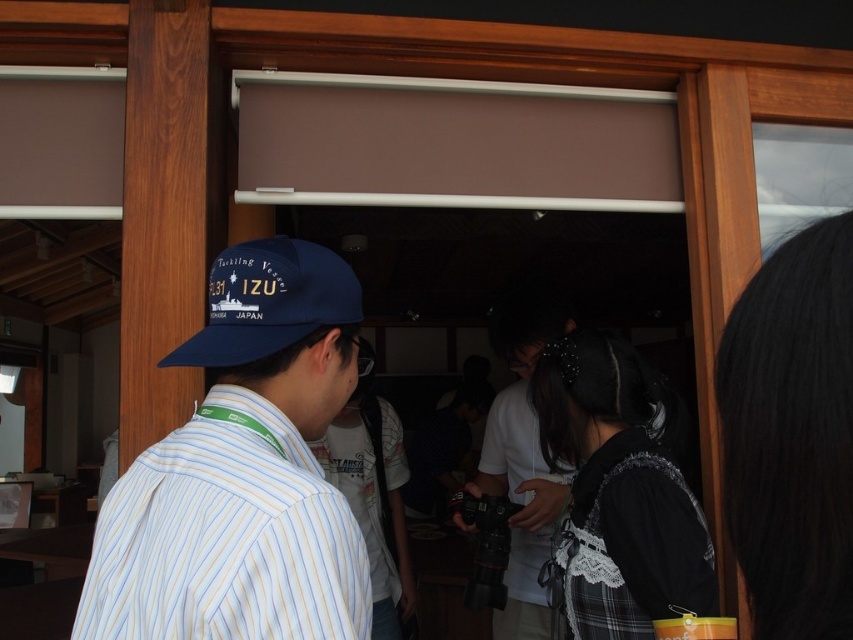
Question: Is white matte shirt at center positioned in front of matte blue baseball cap at upper left?

Choices:
 (A) no
 (B) yes

Answer: (A)

Question: Among these objects, which one is farthest from the camera?

Choices:
 (A) striped cotton shirt at center
 (B) matte blue baseball cap at upper left
 (C) white matte shirt at center

Answer: (C)

Question: Which object is positioned closest to the striped cotton shirt at center?

Choices:
 (A) matte blue baseball cap at upper left
 (B) blue fabric cap at center
 (C) white matte shirt at center

Answer: (C)

Question: Where is white matte shirt at center located in relation to striped cotton shirt at center in the image?

Choices:
 (A) left
 (B) right

Answer: (B)

Question: Does blue fabric cap at center appear under matte blue baseball cap at upper left?

Choices:
 (A) no
 (B) yes

Answer: (B)

Question: Which object is closer to the camera taking this photo?

Choices:
 (A) matte blue baseball cap at upper left
 (B) striped cotton shirt at center
 (C) blue fabric cap at center
 (D) white matte shirt at center

Answer: (C)